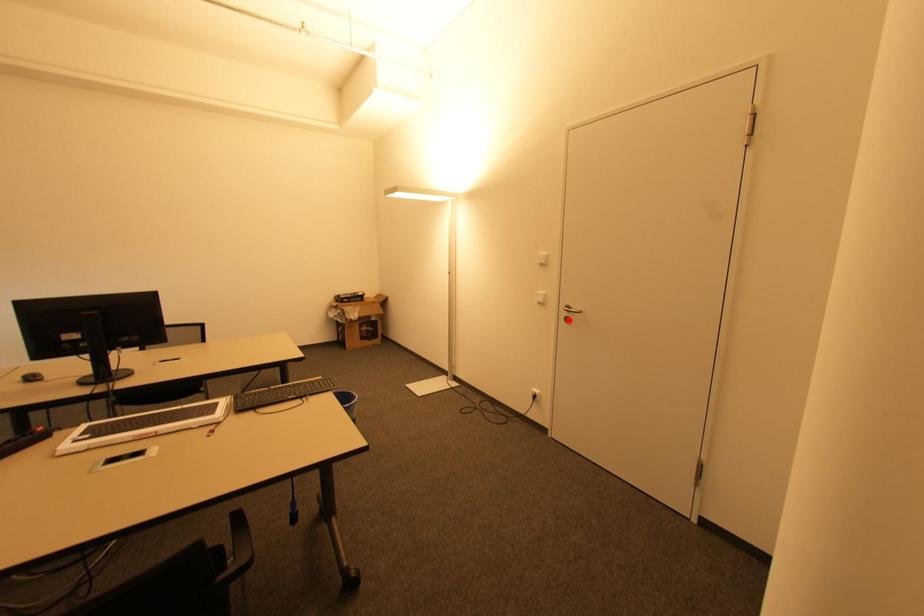
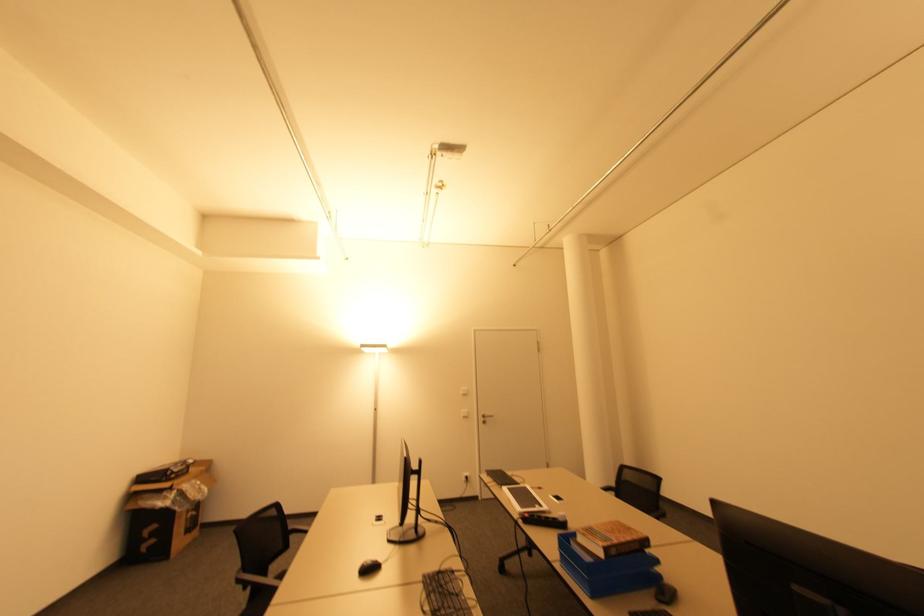
The point at the highlighted location is marked in the first image. Where is the corresponding point in the second image?

(485, 422)